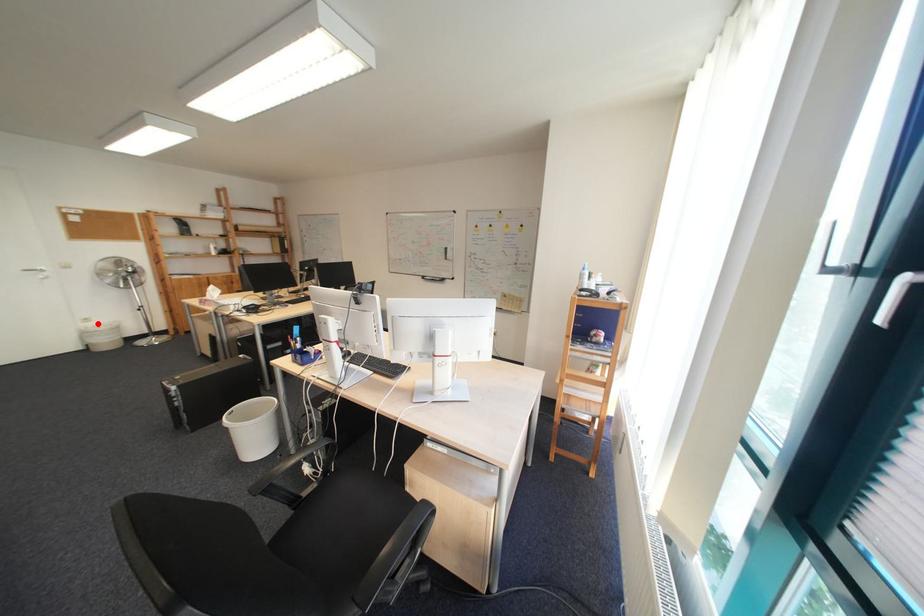
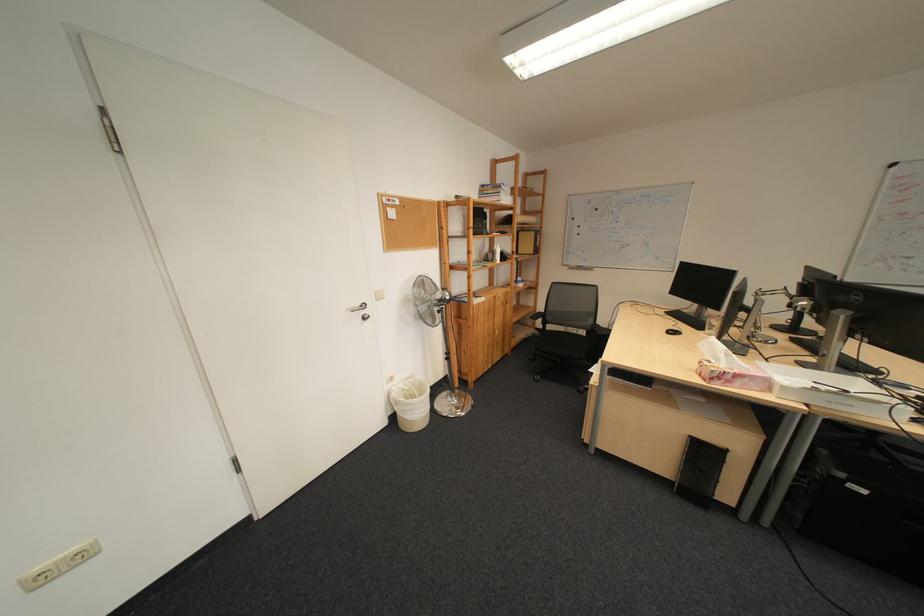
In the second image, find the point that corresponds to the highlighted location in the first image.

(402, 386)